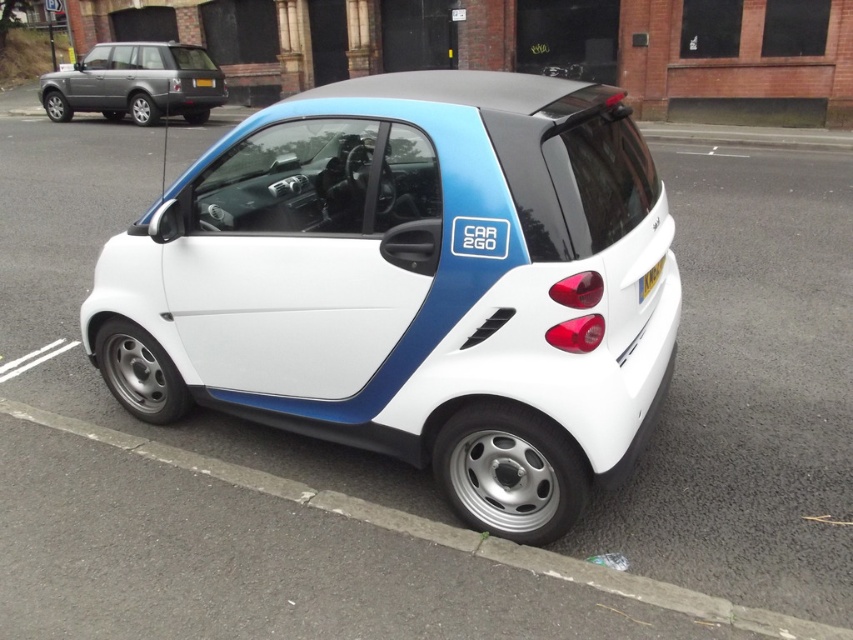
Question: Estimate the real-world distances between objects in this image. Which object is closer to the silver metallic suv at upper left?

Choices:
 (A) gray asphalt curb at lower center
 (B) yellow plastic license plate at rear

Answer: (A)

Question: Does white matte car at center have a larger size compared to gray asphalt curb at lower center?

Choices:
 (A) yes
 (B) no

Answer: (A)

Question: From the image, what is the correct spatial relationship of white matte car at center in relation to gray asphalt curb at lower center?

Choices:
 (A) left
 (B) right

Answer: (B)

Question: Is gray asphalt curb at lower center above yellow plastic license plate at rear?

Choices:
 (A) no
 (B) yes

Answer: (A)

Question: Estimate the real-world distances between objects in this image. Which object is closer to the silver metallic suv at upper left?

Choices:
 (A) yellow plastic license plate at rear
 (B) white matte car at center

Answer: (B)

Question: Which object is closer to the camera taking this photo?

Choices:
 (A) yellow plastic license plate at rear
 (B) gray asphalt curb at lower center
 (C) white matte car at center

Answer: (B)